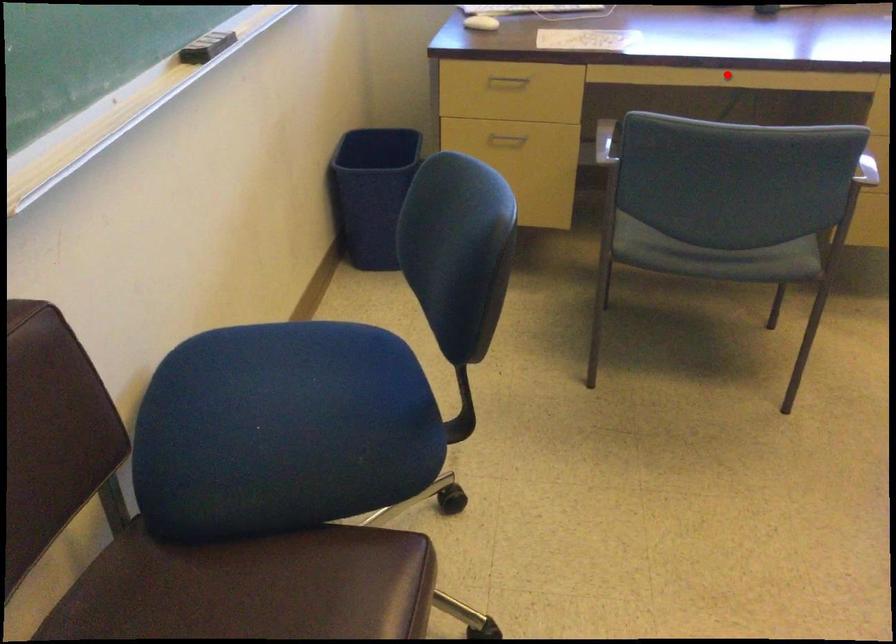
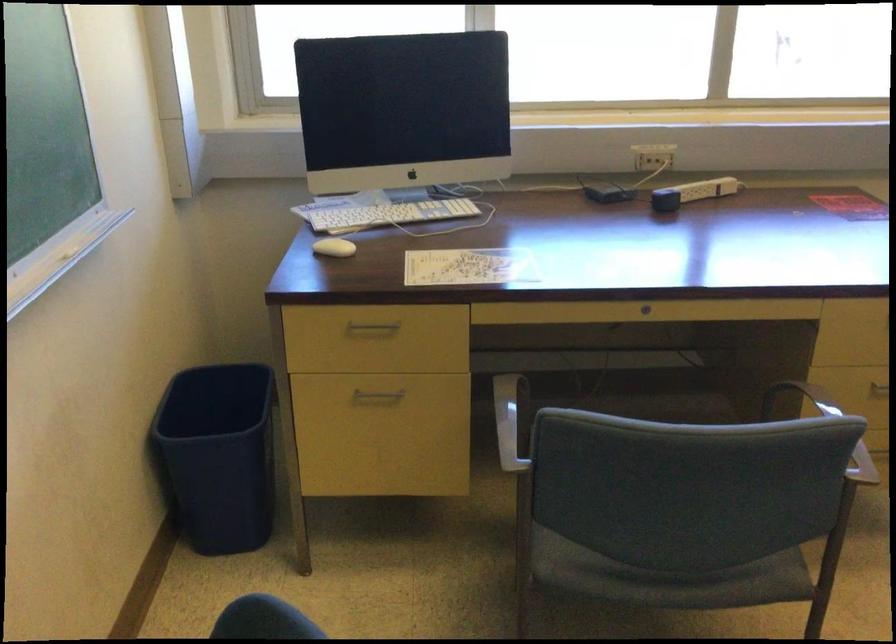
In the second image, find the point that corresponds to the highlighted location in the first image.

(645, 308)